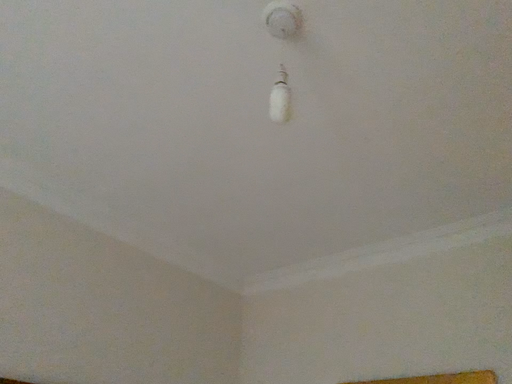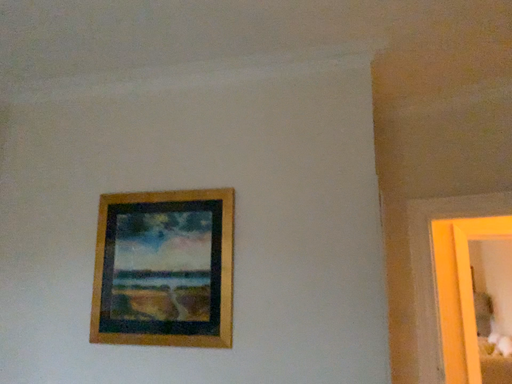
Question: How did the camera likely rotate when shooting the video?

Choices:
 (A) rotated upward
 (B) rotated downward

Answer: (B)